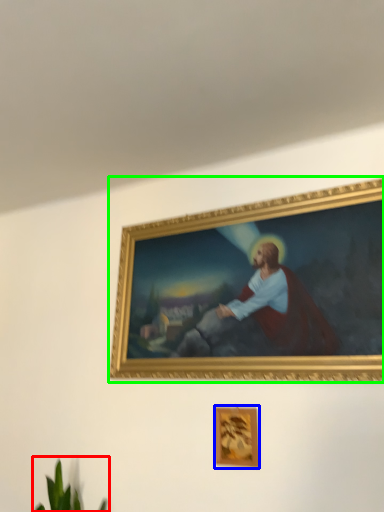
Question: Estimate the real-world distances between objects in this image. Which object is closer to plant (highlighted by a red box), picture frame (highlighted by a blue box) or picture frame (highlighted by a green box)?

Choices:
 (A) picture frame
 (B) picture frame

Answer: (A)